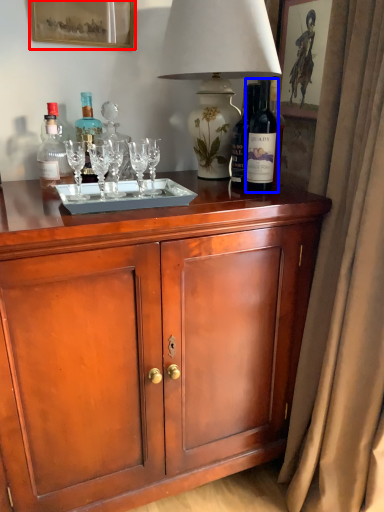
Question: Which of the following is the closest to the observer, picture frame (highlighted by a red box) or bottle (highlighted by a blue box)?

Choices:
 (A) picture frame
 (B) bottle

Answer: (B)